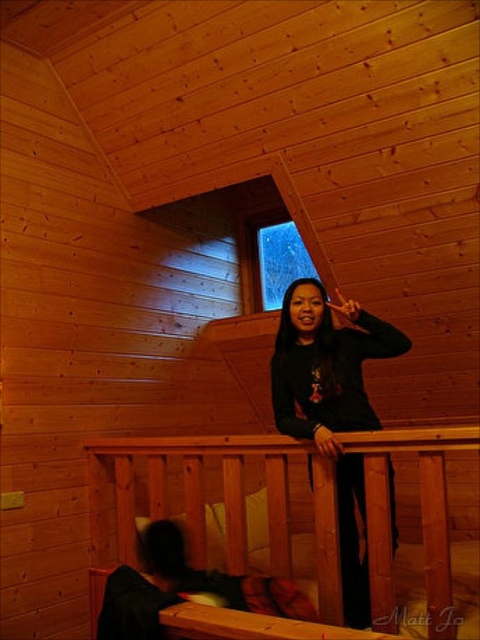
Question: Based on their relative distances, which object is nearer to the transparent glass window at upper center?

Choices:
 (A) wooden rail at upper center
 (B) black matte hoodie at upper center

Answer: (B)

Question: Does black matte hoodie at upper center lie behind transparent glass window at upper center?

Choices:
 (A) no
 (B) yes

Answer: (A)

Question: Which object is the farthest from the transparent glass window at upper center?

Choices:
 (A) black matte hoodie at upper center
 (B) wooden rail at upper center

Answer: (B)

Question: Can you confirm if wooden rail at upper center is positioned to the right of transparent glass window at upper center?

Choices:
 (A) yes
 (B) no

Answer: (B)

Question: Which point is closer to the camera?

Choices:
 (A) wooden rail at upper center
 (B) transparent glass window at upper center

Answer: (A)

Question: Does wooden rail at upper center appear on the left side of black matte hoodie at upper center?

Choices:
 (A) yes
 (B) no

Answer: (A)